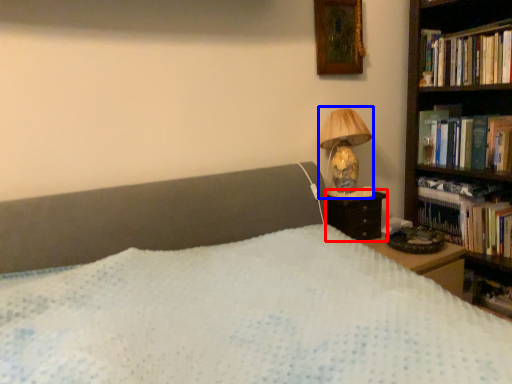
Question: Which object is closer to the camera taking this photo, nightstand (highlighted by a red box) or lamp (highlighted by a blue box)?

Choices:
 (A) nightstand
 (B) lamp

Answer: (B)